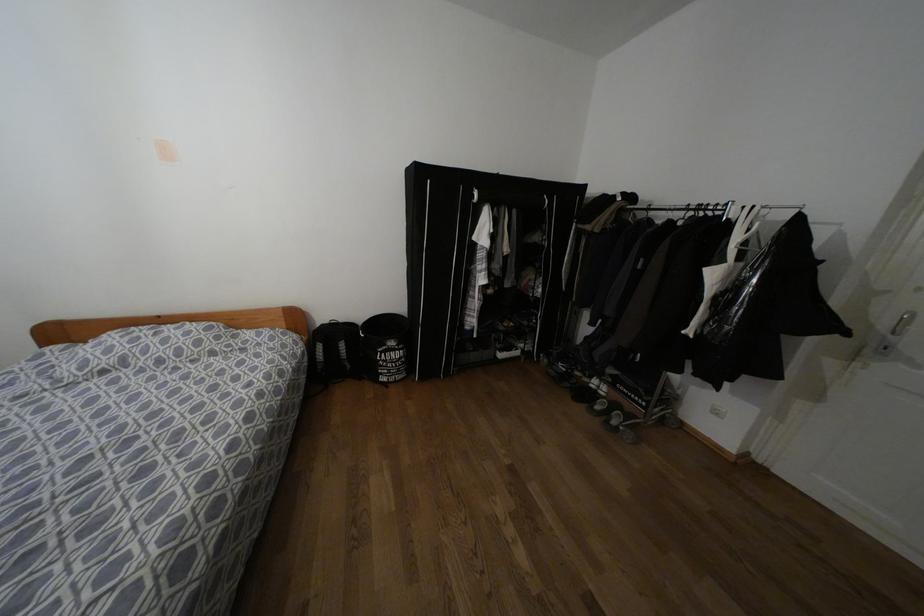
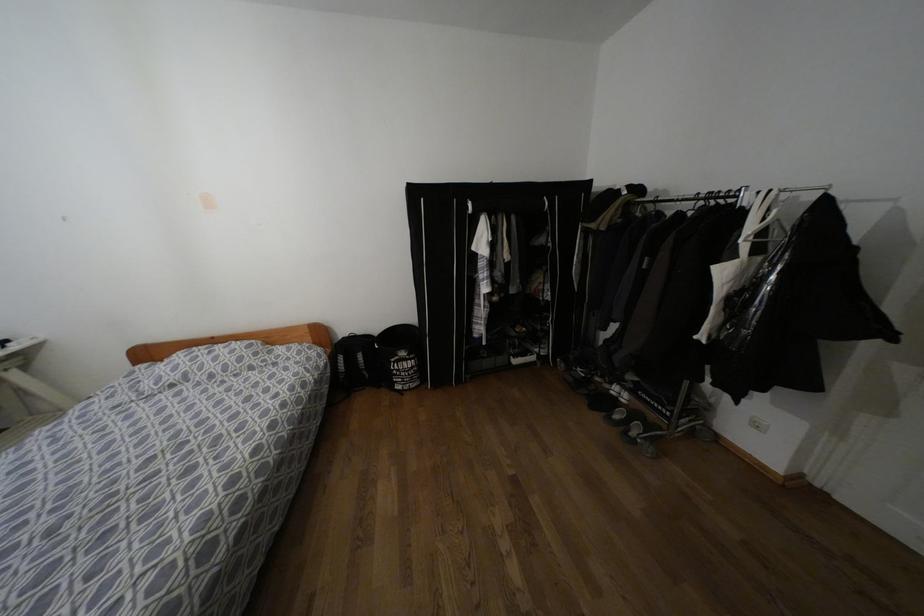
Question: Which direction would the cameraman need to move to produce the second image? Reply with the corresponding letter.

Choices:
 (A) Left
 (B) Right
 (C) Forward
 (D) Backward

Answer: (B)